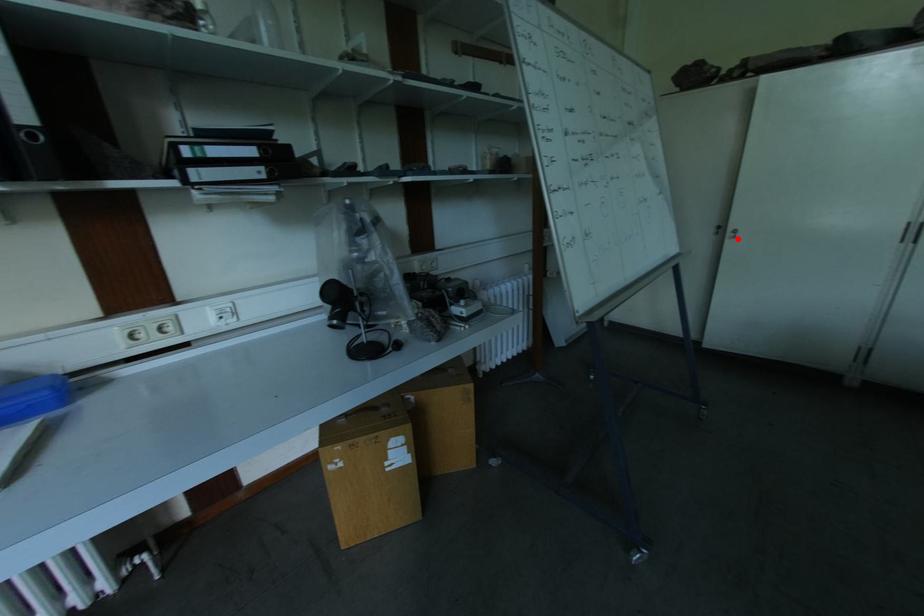
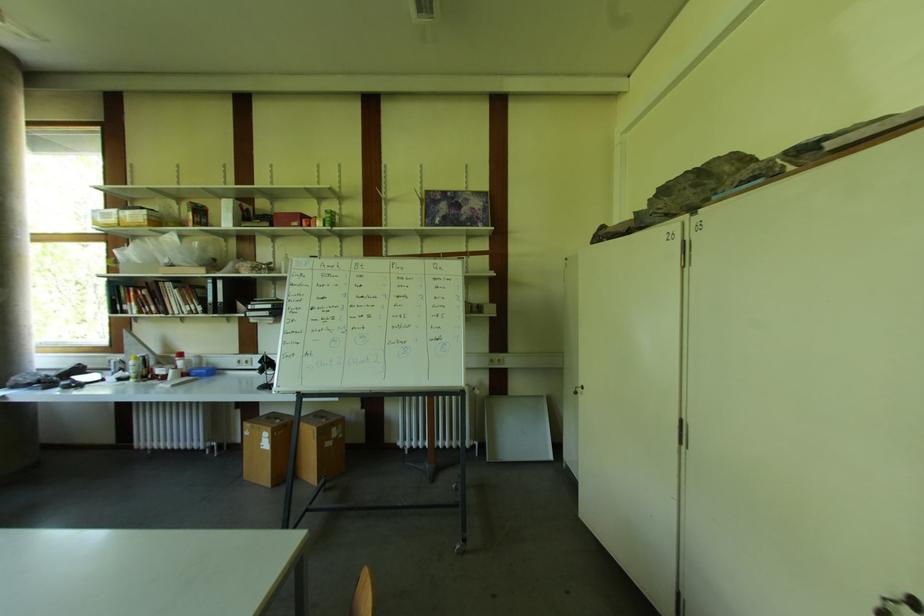
In the second image, find the point that corresponds to the highlighted location in the first image.

(578, 395)